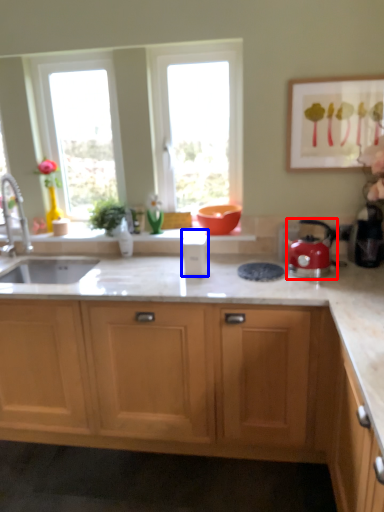
Question: Among these objects, which one is farthest to the camera, kettle (highlighted by a red box) or appliance (highlighted by a blue box)?

Choices:
 (A) kettle
 (B) appliance

Answer: (B)